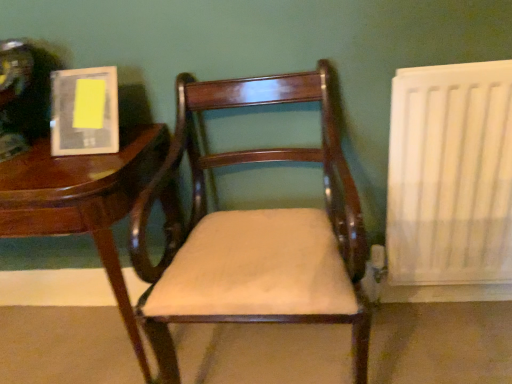
Question: Is white matte radiator at right oriented away from wooden table at left?

Choices:
 (A) yes
 (B) no

Answer: (B)

Question: Can you confirm if white matte radiator at right is positioned to the right of wooden table at left?

Choices:
 (A) no
 (B) yes

Answer: (B)

Question: Does white matte radiator at right come behind wooden table at left?

Choices:
 (A) yes
 (B) no

Answer: (A)

Question: Can you confirm if white matte radiator at right is taller than wooden table at left?

Choices:
 (A) yes
 (B) no

Answer: (A)

Question: Does white matte radiator at right have a lesser width compared to wooden table at left?

Choices:
 (A) no
 (B) yes

Answer: (B)

Question: Can you confirm if white matte radiator at right is positioned to the left of wooden table at left?

Choices:
 (A) yes
 (B) no

Answer: (B)

Question: Does wooden table at left appear on the left side of white matte radiator at right?

Choices:
 (A) no
 (B) yes

Answer: (B)

Question: From a real-world perspective, is wooden table at left located higher than white matte radiator at right?

Choices:
 (A) yes
 (B) no

Answer: (B)

Question: Considering the relative sizes of wooden table at left and white matte radiator at right in the image provided, is wooden table at left thinner than white matte radiator at right?

Choices:
 (A) yes
 (B) no

Answer: (B)

Question: Considering the relative positions of wooden table at left and white matte radiator at right in the image provided, is wooden table at left in front of white matte radiator at right?

Choices:
 (A) yes
 (B) no

Answer: (A)

Question: Is wooden table at left aimed at white matte radiator at right?

Choices:
 (A) yes
 (B) no

Answer: (B)

Question: Does wooden table at left have a greater height compared to white matte radiator at right?

Choices:
 (A) yes
 (B) no

Answer: (B)

Question: Would you say matte plastic book at upper left is part of wooden table at left's contents?

Choices:
 (A) no
 (B) yes

Answer: (A)